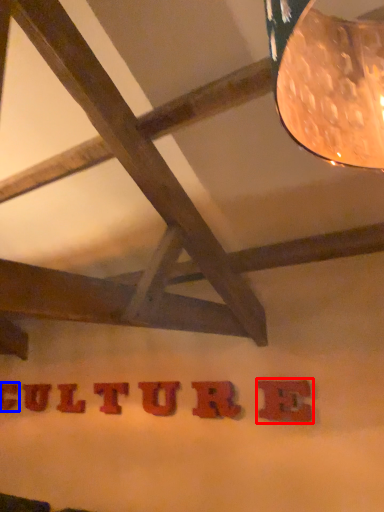
Question: Which object appears farthest to the camera in this image, letter (highlighted by a red box) or letter (highlighted by a blue box)?

Choices:
 (A) letter
 (B) letter

Answer: (B)